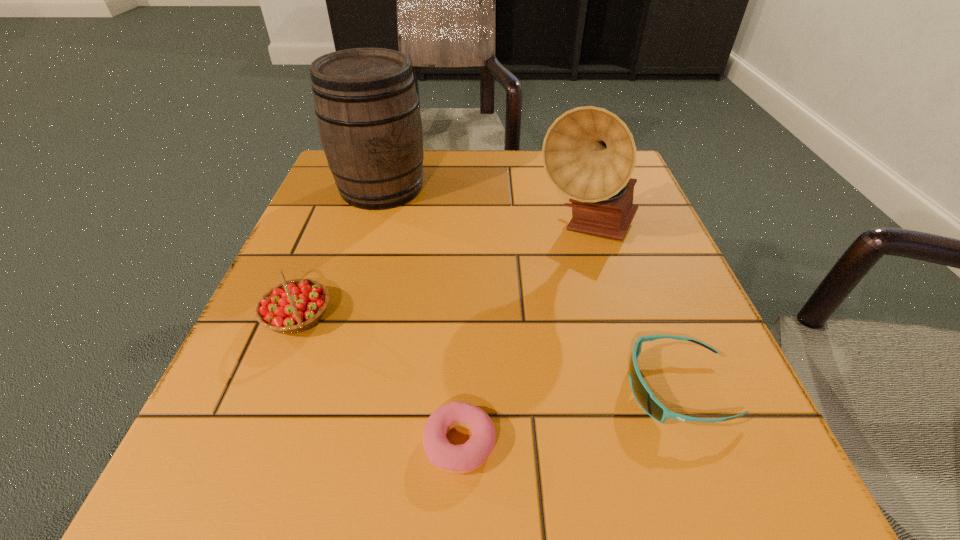
Find the location of a particular element. unoccupied area between the wine bucket and the phonograph record is located at coordinates (485, 209).

Locate an element on the screen. free space between the second shortest object and the third shortest object is located at coordinates point(488,352).

This screenshot has height=540, width=960. Identify the location of free space between the wine bucket and the third object from left to right. (x=420, y=315).

You are a GUI agent. You are given a task and a screenshot of the screen. Output one action in this format:
    pyautogui.click(x=<x>, y=<y>)
    Task: Click on the vacant point located between the third tallest object and the wine bucket
    The image size is (960, 540).
    Given the screenshot: What is the action you would take?
    pyautogui.click(x=340, y=252)

In order to click on free space that is in between the sunglasses and the third object from right to left in this screenshot , I will do `click(568, 415)`.

You are a GUI agent. You are given a task and a screenshot of the screen. Output one action in this format:
    pyautogui.click(x=<x>, y=<y>)
    Task: Click on the free space between the shortest object and the strawberry
    
    Given the screenshot: What is the action you would take?
    pyautogui.click(x=379, y=380)

Where is `empty space between the third shortest object and the sunglasses`? This screenshot has height=540, width=960. empty space between the third shortest object and the sunglasses is located at coordinates (488, 352).

Locate an element on the screen. vacant space that is in between the wine bucket and the sunglasses is located at coordinates (530, 288).

What are the coordinates of `object that stands as the closest to the phonograph record` in the screenshot? It's located at (644, 396).

The height and width of the screenshot is (540, 960). In order to click on object identified as the second closest to the second shortest object in this screenshot , I will do `click(589, 154)`.